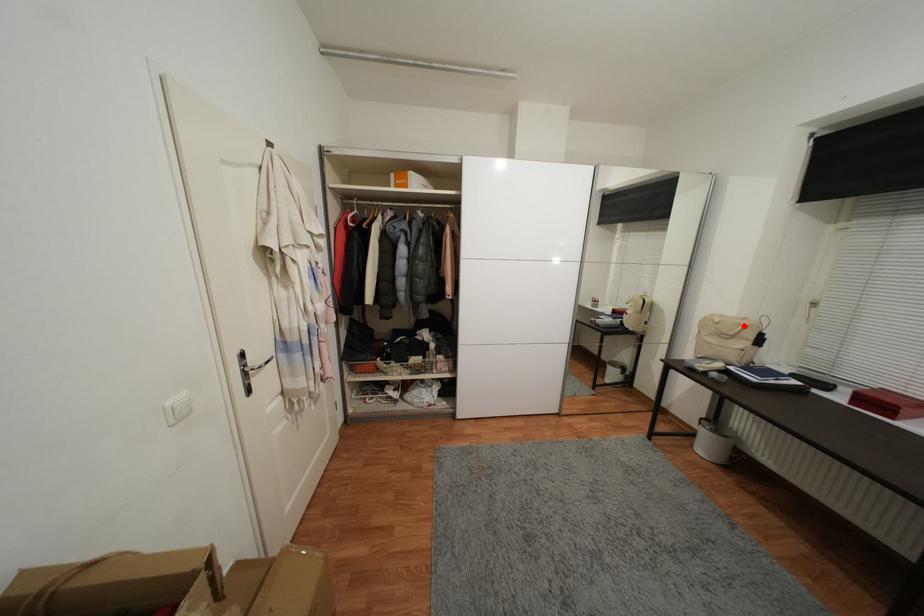
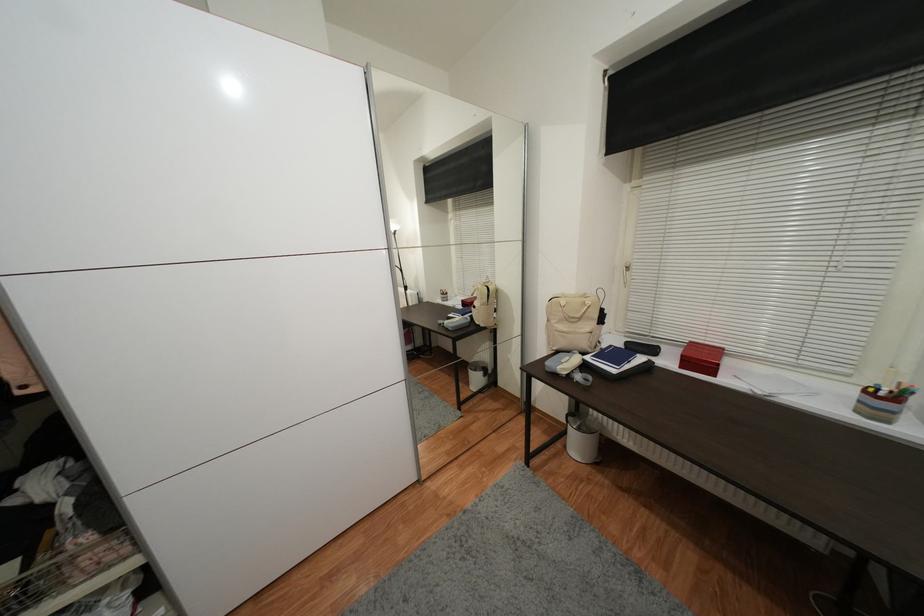
Question: I am providing you with two images of the same scene from different viewpoints. A red point is marked on the first image. At the location where the point appears in image 1, is it still visible in image 2?

Choices:
 (A) Yes
 (B) No

Answer: (A)